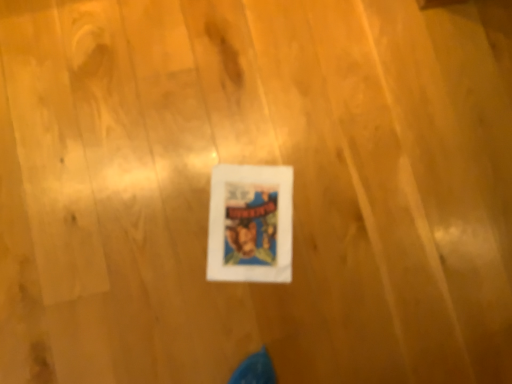
The image size is (512, 384). What do you see at coordinates (250, 224) in the screenshot?
I see `white paper at center` at bounding box center [250, 224].

This screenshot has width=512, height=384. I want to click on white paper at center, so click(250, 224).

Locate an element on the screen. The width and height of the screenshot is (512, 384). white paper at center is located at coordinates (250, 224).